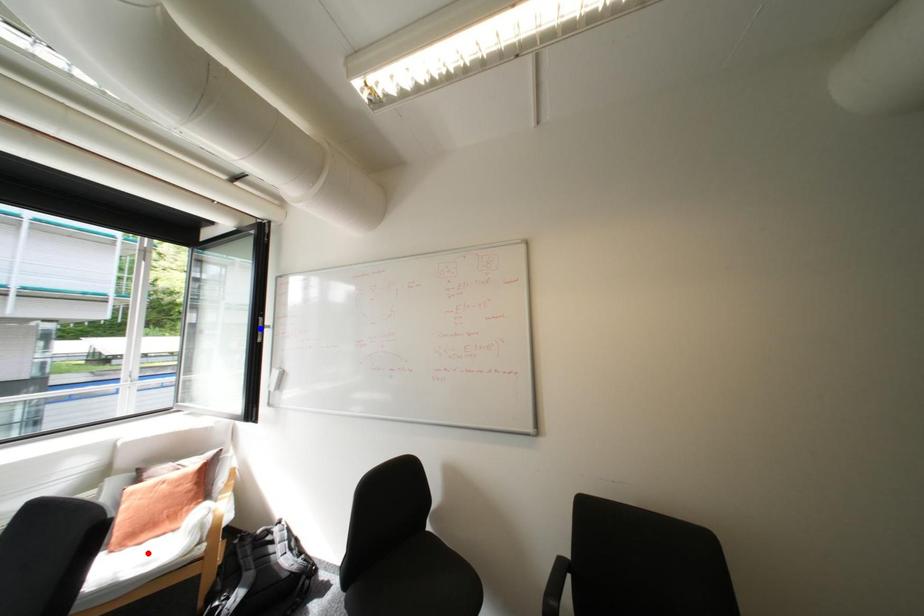
Question: Which of the two points in the image is closer to the camera?

Choices:
 (A) Blue point is closer.
 (B) Red point is closer.

Answer: (B)